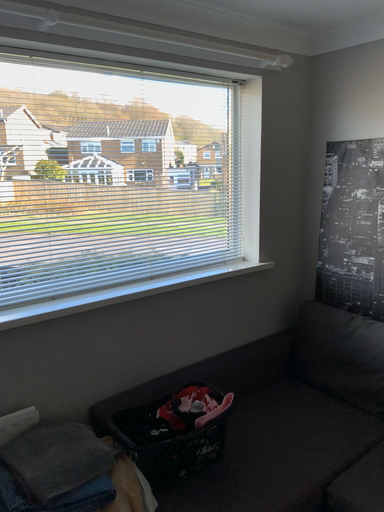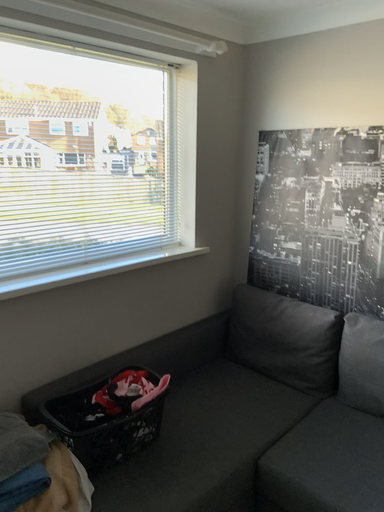
Question: Which way did the camera rotate in the video?

Choices:
 (A) rotated left
 (B) rotated right

Answer: (B)